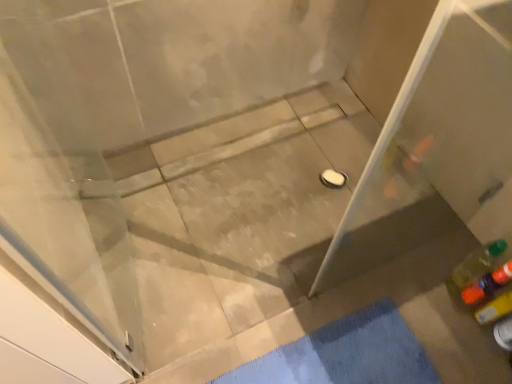
Where is `vacant area in front of translucent plastic bottle at lower right`? This screenshot has height=384, width=512. vacant area in front of translucent plastic bottle at lower right is located at coordinates (468, 348).